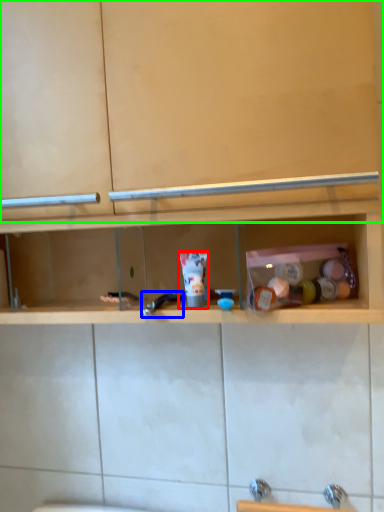
Question: Based on their relative distances, which object is nearer to toiletry (highlighted by a red box)? Choose from faucet (highlighted by a blue box) and cabinet (highlighted by a green box).

Choices:
 (A) faucet
 (B) cabinet

Answer: (A)